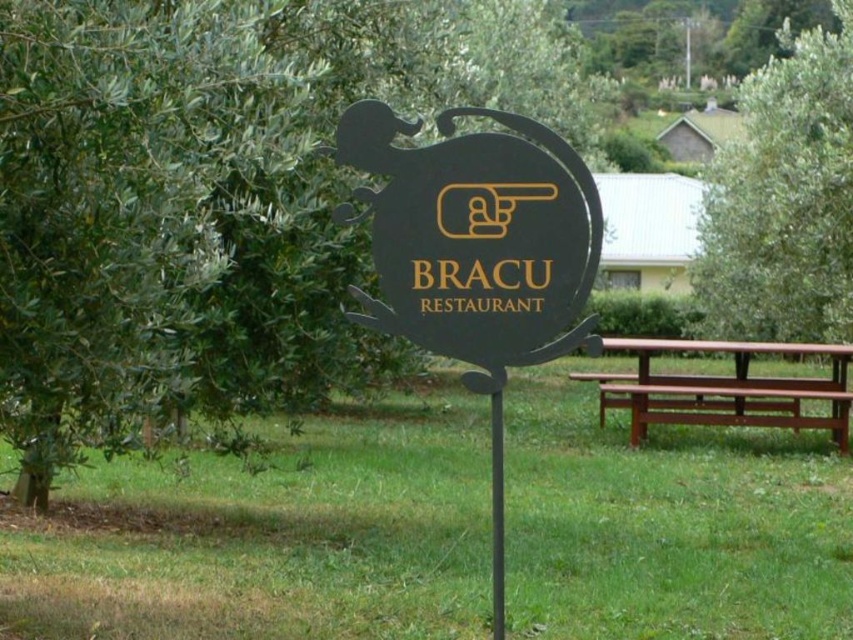
Does green leafy tree at center have a smaller size compared to black matte sign at center?

No, green leafy tree at center is not smaller than black matte sign at center.

Does point (231, 35) lie behind point (418, 212)?

Yes, it is.

Identify the location of green leafy tree at center. (212, 195).

Where is `green leafy tree at center`? This screenshot has width=853, height=640. green leafy tree at center is located at coordinates (212, 195).

Is green grass at center to the left of black matte sign at center from the viewer's perspective?

No, green grass at center is not to the left of black matte sign at center.

Can you confirm if green grass at center is thinner than black matte sign at center?

No.

What are the coordinates of `green grass at center` in the screenshot? It's located at (271, 540).

Consider the image. Can you confirm if green leafy tree at center is wider than green leafy tree at right?

Incorrect, green leafy tree at center's width does not surpass green leafy tree at right's.

Where is `green leafy tree at center`? green leafy tree at center is located at coordinates (212, 195).

Does point (111, 86) come closer to viewer compared to point (770, 284)?

Yes, point (111, 86) is in front of point (770, 284).

Locate an element on the screen. Image resolution: width=853 pixels, height=640 pixels. green leafy tree at center is located at coordinates (212, 195).